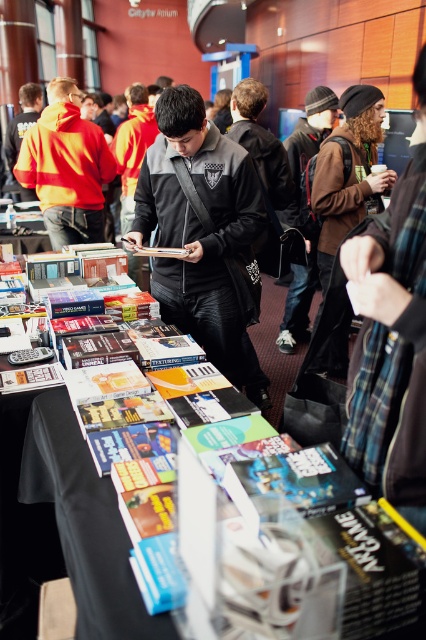
Question: Does orange-yellow hoodie at left come in front of brown leather jacket at center?

Choices:
 (A) no
 (B) yes

Answer: (A)

Question: Which is nearer to the orange-yellow hoodie at left?

Choices:
 (A) black matte jacket at center
 (B) brown leather jacket at center

Answer: (B)

Question: Considering the real-world distances, which object is farthest from the black matte jacket at center?

Choices:
 (A) brown leather jacket at center
 (B) orange-yellow hoodie at left

Answer: (B)

Question: Among these points, which one is nearest to the camera?

Choices:
 (A) (304, 272)
 (B) (264, 403)
 (C) (77, 196)

Answer: (B)

Question: Does black matte jacket at center lie behind brown leather jacket at center?

Choices:
 (A) no
 (B) yes

Answer: (A)

Question: Observing the image, what is the correct spatial positioning of black matte jacket at center in reference to brown leather jacket at center?

Choices:
 (A) left
 (B) right

Answer: (A)